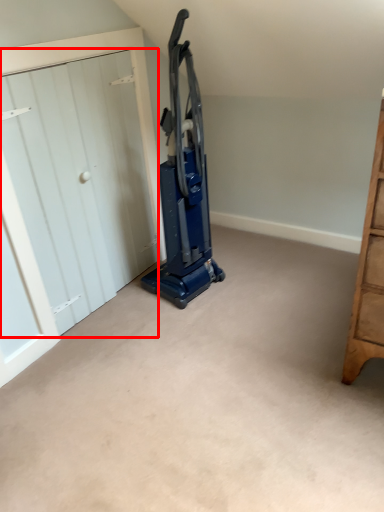
Question: From the image's perspective, what is the correct spatial relationship of door (annotated by the red box) in relation to equipment?

Choices:
 (A) above
 (B) below

Answer: (B)